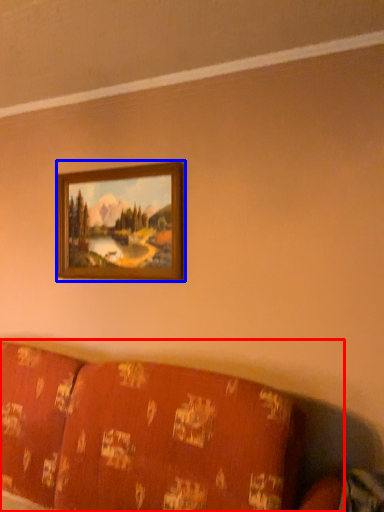
Question: Which of the following is the farthest to the observer, furniture (highlighted by a red box) or picture frame (highlighted by a blue box)?

Choices:
 (A) furniture
 (B) picture frame

Answer: (B)